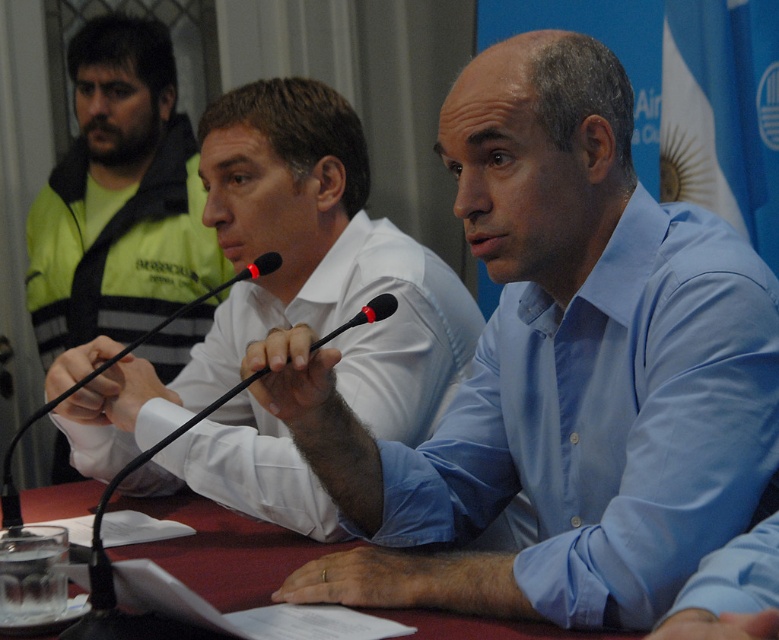
You are a photographer trying to capture a closeup shot of the light blue shirt at center without including the maroon fabric table at center. Given that your camera has a depth of field that can focus on objects within 12 inches of each other, will you be able to achieve this?

The light blue shirt at center is 13.00 inches away from the maroon fabric table at center. Since the distance between them is greater than the 12 inches depth of field, the photographer can adjust focus to capture the light blue shirt at center while blurring the maroon fabric table at center, achieving the desired closeup without including the table.